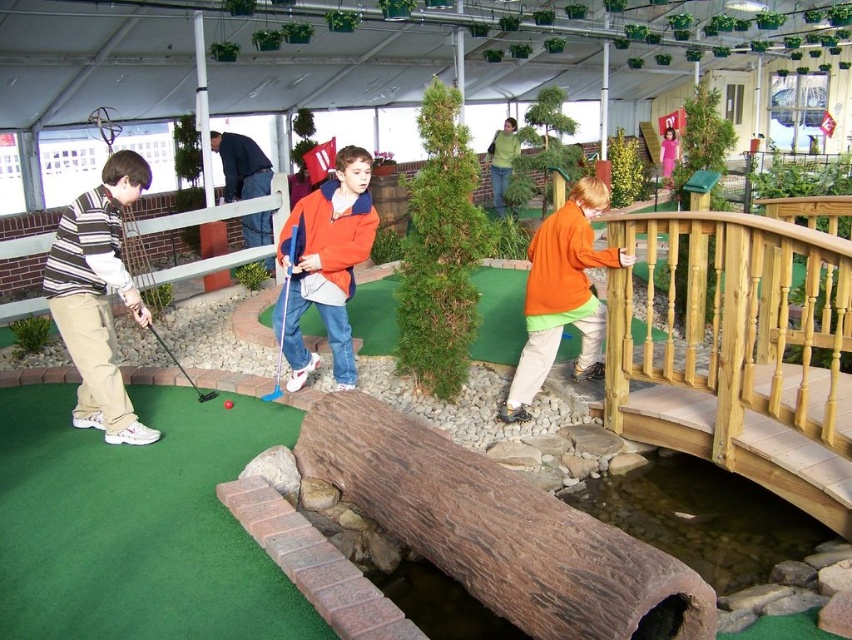
From the picture: You are a photographer standing at the entrance of the indoor miniature golf course. You want to take a photo of the striped sweater at left and the green artificial turf at lower left. Which object will appear larger in your photo?

The green artificial turf at lower left will appear larger in the photo because it is closer to the viewer than the striped sweater at left.

You are a photographer standing at the entrance of the indoor miniature golf course. You want to take a photo that includes both the point at coordinates point (x=309, y=605) and the point at coordinates point (x=119, y=237). Which point should you focus on first to ensure both are in focus?

You should focus on point (x=119, y=237) first because it is farther from the camera than point (x=309, y=605). By focusing on the farther point, the closer point will also be within the depth of field.

You are a golfer trying to hit the ball from the starting point to the hole. The starting point is marked by the green artificial turf at lower left. Can you determine the coordinates of the starting point?

The green artificial turf at lower left is located at point (137, 524), so the starting point coordinates are (137, 524).